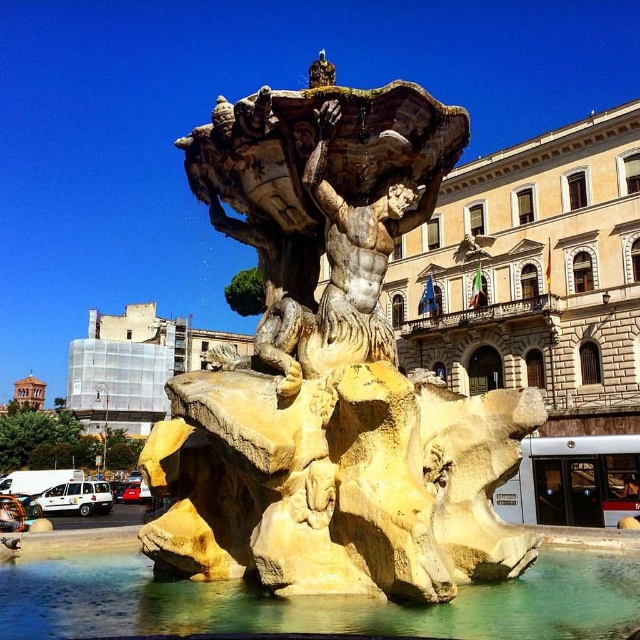
Question: Can you confirm if yellow stone fountain at center is thinner than clear water at fountain center?

Choices:
 (A) no
 (B) yes

Answer: (B)

Question: Is yellow stone fountain at center to the right of clear water at fountain center from the viewer's perspective?

Choices:
 (A) yes
 (B) no

Answer: (A)

Question: Is yellow stone fountain at center positioned behind clear water at fountain center?

Choices:
 (A) no
 (B) yes

Answer: (B)

Question: Among these objects, which one is farthest from the camera?

Choices:
 (A) yellow stone fountain at center
 (B) clear water at fountain center

Answer: (A)

Question: Which object appears closest to the camera in this image?

Choices:
 (A) clear water at fountain center
 (B) yellow stone fountain at center

Answer: (A)